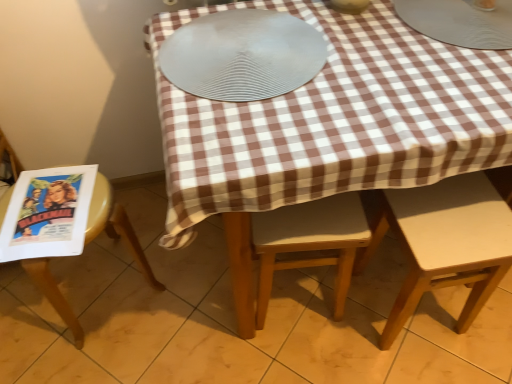
Locate an element on the screen. empty space that is ontop of light brown wooden chair at center, placed as the second chair when sorted from left to right (from a real-world perspective) is located at coordinates (314, 216).